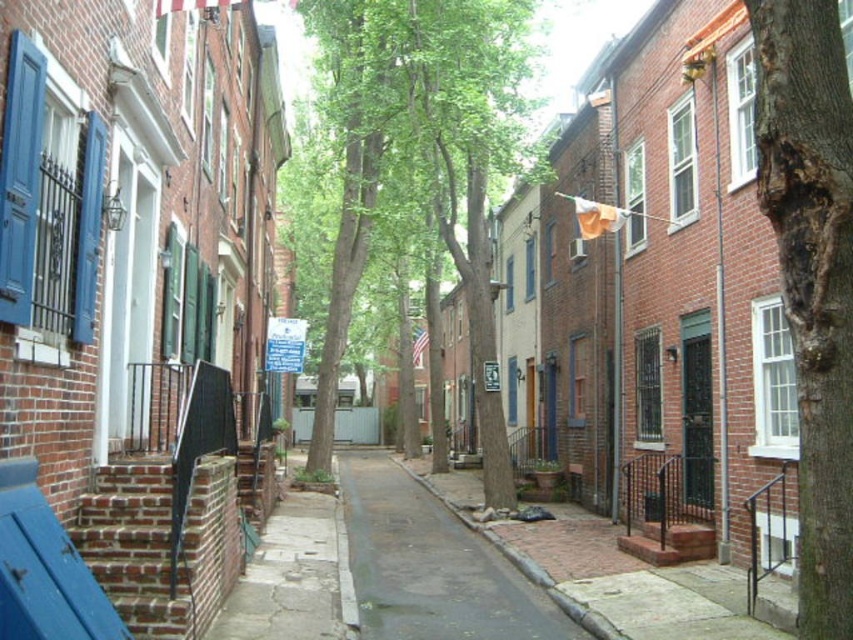
Question: Can you confirm if green leafy tree at center is positioned to the right of rough bark tree at right?

Choices:
 (A) no
 (B) yes

Answer: (A)

Question: Among these points, which one is farthest from the camera?

Choices:
 (A) (808, 627)
 (B) (433, 625)

Answer: (B)

Question: Is green leafy tree at center in front of dark gray asphalt at center?

Choices:
 (A) no
 (B) yes

Answer: (A)

Question: Which point is closer to the camera?

Choices:
 (A) (369, 598)
 (B) (798, 161)

Answer: (B)

Question: Is green leafy tree at center below dark gray asphalt at center?

Choices:
 (A) no
 (B) yes

Answer: (A)

Question: Which point is farther from the camera taking this photo?

Choices:
 (A) (828, 150)
 (B) (422, 620)

Answer: (B)